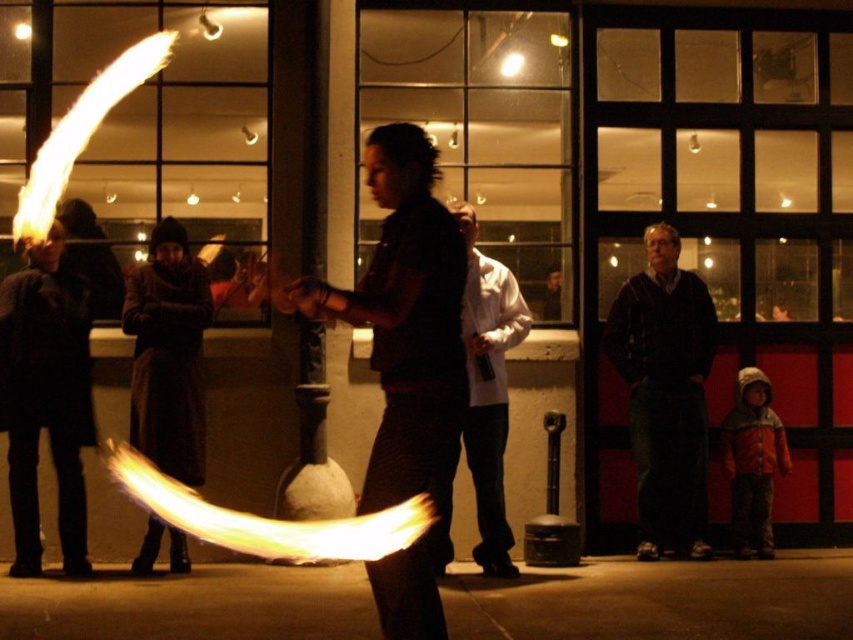
You are attending a winter festival and see the dark brown leather jacket at right and the white matte jacket at center. Which jacket is positioned lower in the image?

The dark brown leather jacket at right is located below the white matte jacket at center, so it is positioned lower in the image.

Consider the image. You are an event planner designing a layout for the fire show area. You need to ensure that the matte black shirt at center and the white matte jacket at center are visible to all attendees. Given their height differences, which clothing item might require a higher placement to ensure visibility?

The white matte jacket at center is taller than the matte black shirt at center, so to ensure visibility for all attendees, the white matte jacket at center should be placed higher to avoid blocking the view of the shorter matte black shirt at center.

Looking at this image, you are a photographer at the event and want to capture both the matte black shirt at center and the white matte jacket at center in a single frame. Which object should you focus on first to ensure both are in focus?

The matte black shirt at center is smaller than the white matte jacket at center, so you should focus on the white matte jacket at center first to ensure both are in focus.